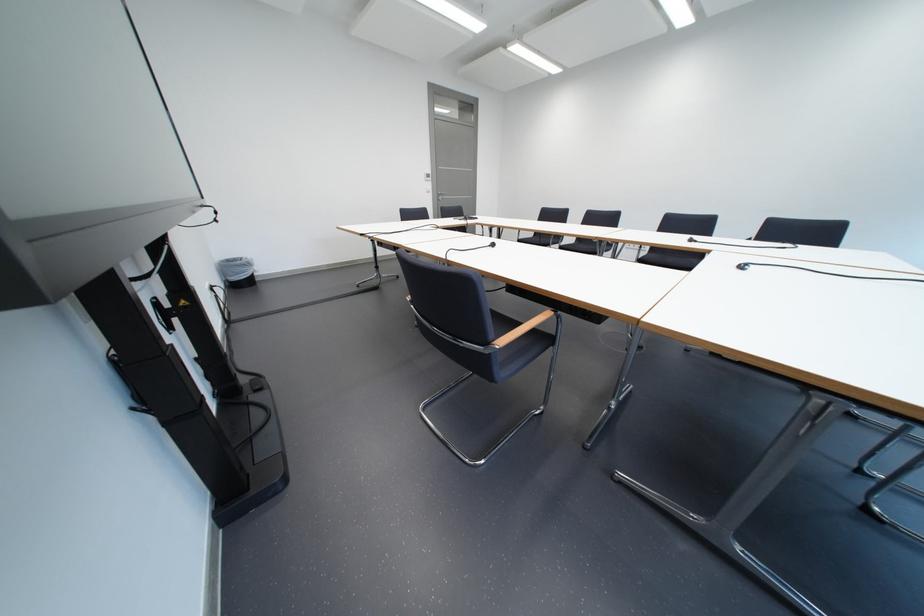
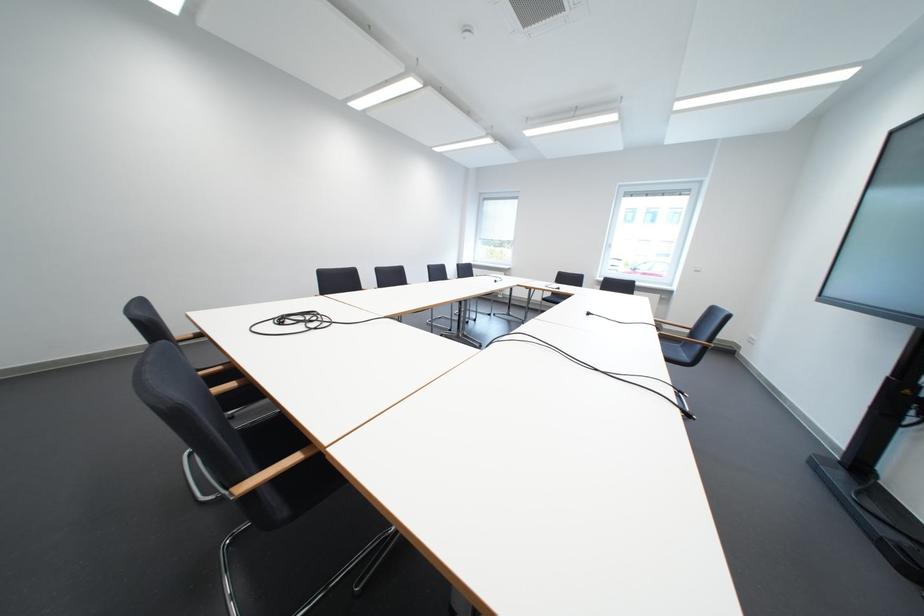
Locate, in the second image, the point that corresponds to pixel 505 246 in the first image.

(601, 315)